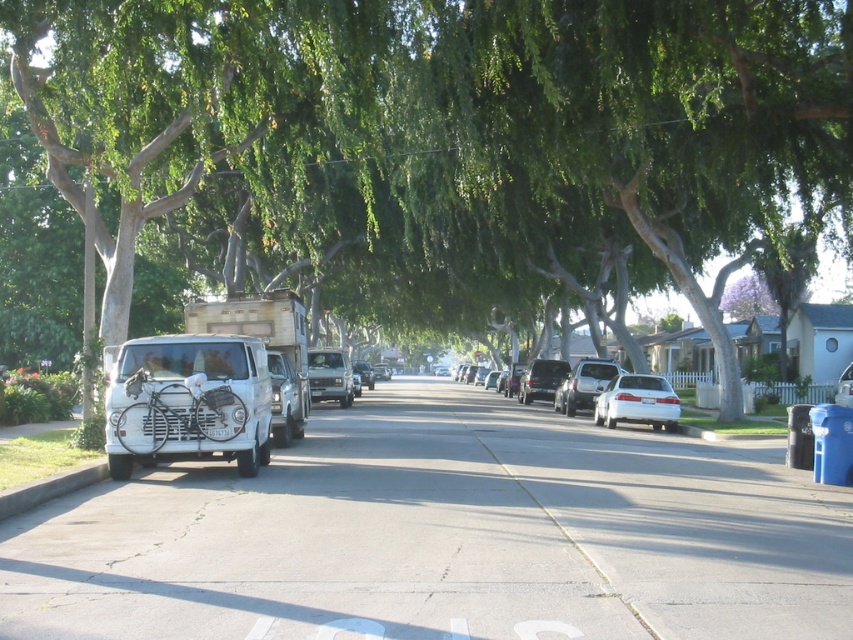
Question: Which point appears farthest from the camera in this image?

Choices:
 (A) (834, 397)
 (B) (531, 394)
 (C) (181, 456)

Answer: (B)

Question: Does white matte truck at center have a larger size compared to white matte car at center?

Choices:
 (A) no
 (B) yes

Answer: (A)

Question: Can you confirm if white matte sedan at center is smaller than metallic silver jeep at center?

Choices:
 (A) no
 (B) yes

Answer: (A)

Question: Does metallic silver jeep at center appear over silver metallic sedan at center?

Choices:
 (A) yes
 (B) no

Answer: (B)

Question: Which object is closer to the camera taking this photo?

Choices:
 (A) white matte van at center
 (B) white glossy sedan at center-right
 (C) gray concrete curb at lower left
 (D) silver metallic jeep at center-right

Answer: (C)

Question: Which object is positioned farthest from the gray concrete curb at lower left?

Choices:
 (A) dark gray matte jeep at center
 (B) white matte sedan at center

Answer: (A)